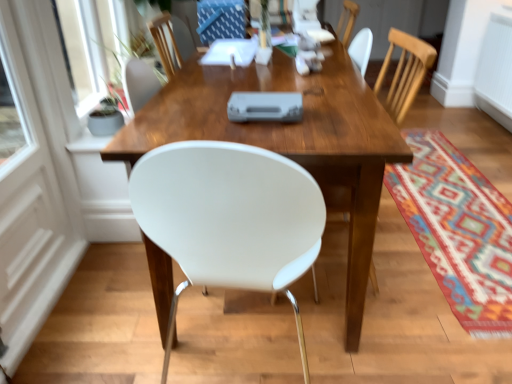
Identify the location of vacant region below multicolored woven mat at lower right (from a real-world perspective). This screenshot has height=384, width=512. (454, 197).